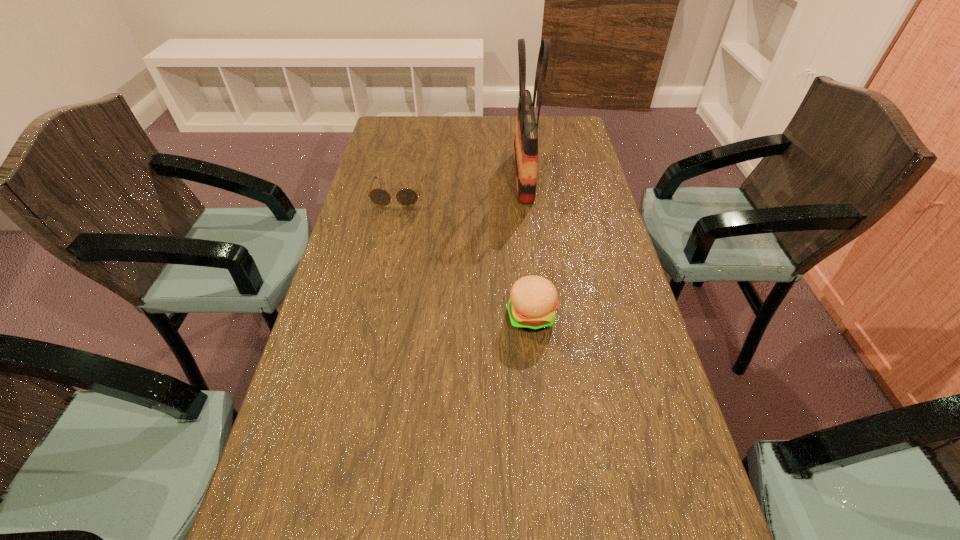
Where is `object at the left edge`? The width and height of the screenshot is (960, 540). object at the left edge is located at coordinates (406, 197).

Where is `vacant space at the far edge of the desktop`? vacant space at the far edge of the desktop is located at coordinates (502, 137).

Locate an element on the screen. blank space at the left edge of the desktop is located at coordinates (289, 509).

Where is `vacant region at the right edge`? vacant region at the right edge is located at coordinates (697, 514).

Where is `vacant space at the far right corner`? Image resolution: width=960 pixels, height=540 pixels. vacant space at the far right corner is located at coordinates (582, 133).

The width and height of the screenshot is (960, 540). Find the location of `empty space between the nearest object and the tallest object`. empty space between the nearest object and the tallest object is located at coordinates (527, 246).

This screenshot has height=540, width=960. Find the location of `free point between the shopping bag and the shortest object`. free point between the shopping bag and the shortest object is located at coordinates (461, 185).

This screenshot has width=960, height=540. Identify the location of free space between the tallest object and the second shortest object. (527, 246).

Locate an element on the screen. The height and width of the screenshot is (540, 960). free point between the second shortest object and the leftmost object is located at coordinates (465, 255).

The width and height of the screenshot is (960, 540). In order to click on empty space that is in between the hamburger and the sunglasses in this screenshot , I will do `click(465, 255)`.